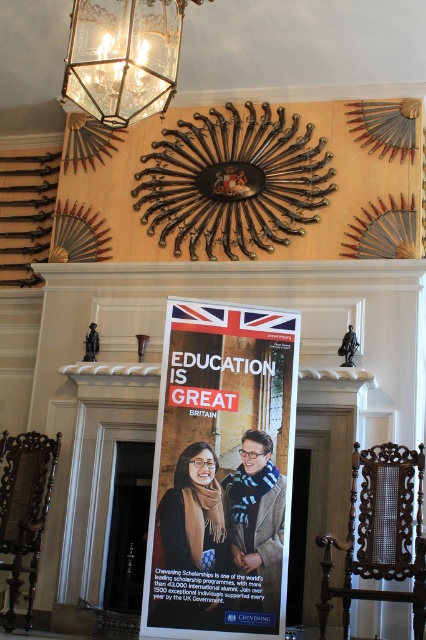
Question: Can you confirm if white paper poster at center is wider than clear glass lantern at upper center?

Choices:
 (A) yes
 (B) no

Answer: (A)

Question: Which of the following is the closest to the observer?

Choices:
 (A) (169, 51)
 (B) (258, 474)

Answer: (A)

Question: Which object is farther from the camera taking this photo?

Choices:
 (A) clear glass lantern at upper center
 (B) white paper poster at center

Answer: (B)

Question: Is white paper poster at center further to the viewer compared to clear glass lantern at upper center?

Choices:
 (A) no
 (B) yes

Answer: (B)

Question: Does white paper poster at center appear under clear glass lantern at upper center?

Choices:
 (A) no
 (B) yes

Answer: (B)